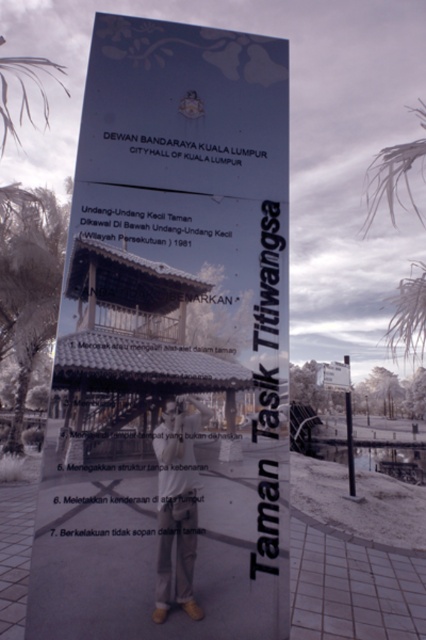
You are standing in front of the signboard and want to read both the transparent plastic sign at center and the white frosty palm tree at upper right. Which one is located higher up?

The transparent plastic sign at center is located higher up than the white frosty palm tree at upper right.